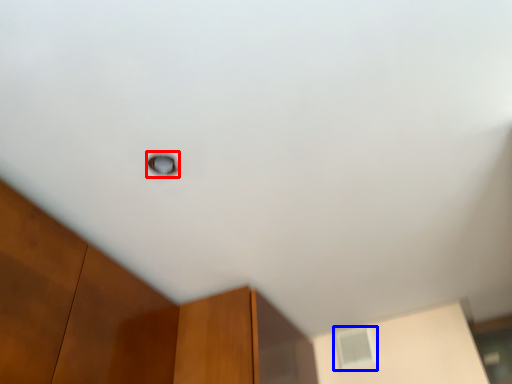
Question: Which of the following is the farthest to the observer, window (highlighted by a red box) or window (highlighted by a blue box)?

Choices:
 (A) window
 (B) window

Answer: (B)